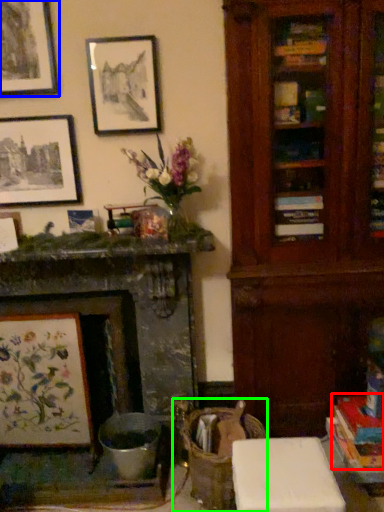
Question: Which is farther away from book (highlighted by a red box)? picture frame (highlighted by a blue box) or swivel chair (highlighted by a green box)?

Choices:
 (A) picture frame
 (B) swivel chair

Answer: (A)